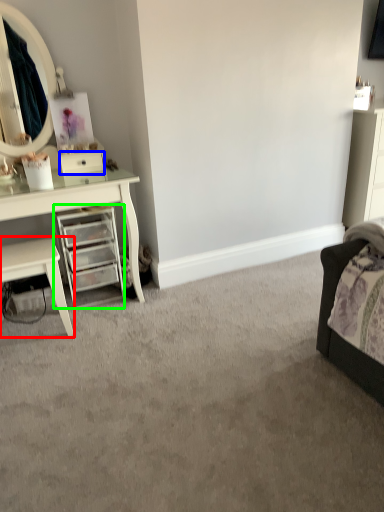
Question: Which object is positioned farthest from nightstand (highlighted by a red box)? Select from drawer (highlighted by a blue box) and chest of drawers (highlighted by a green box).

Choices:
 (A) drawer
 (B) chest of drawers

Answer: (A)